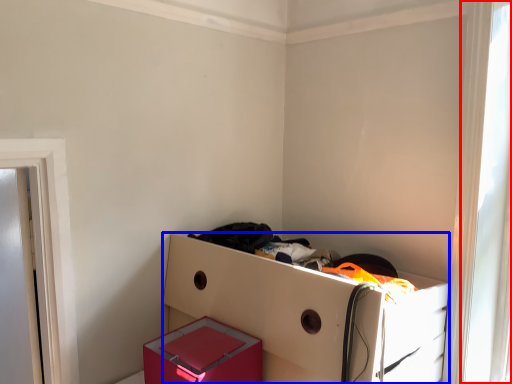
Question: Which of the following is the closest to the observer, window (highlighted by a red box) or furniture (highlighted by a blue box)?

Choices:
 (A) window
 (B) furniture

Answer: (B)